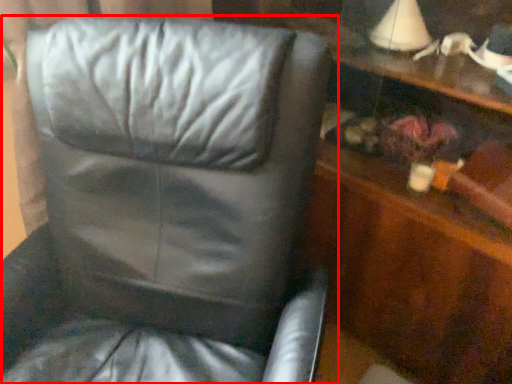
Question: From the image's perspective, what is the correct spatial positioning of chair (annotated by the red box) in reference to dresser?

Choices:
 (A) below
 (B) above

Answer: (A)